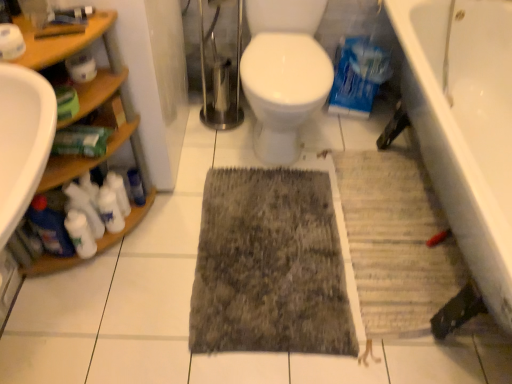
You are a GUI agent. You are given a task and a screenshot of the screen. Output one action in this format:
    pyautogui.click(x=<x>, y=<y>)
    Task: Click on the vacant area located to the right-hand side of blue plastic bottle at left
    
    Given the screenshot: What is the action you would take?
    pyautogui.click(x=190, y=216)